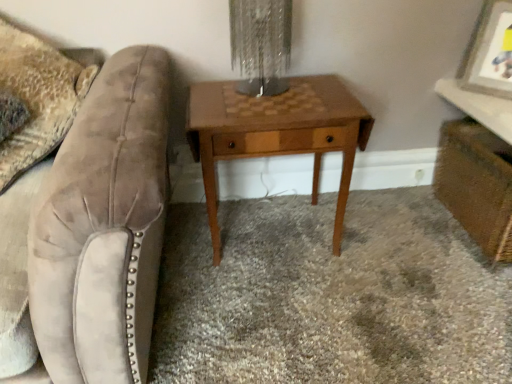
The image size is (512, 384). Identify the location of vacant area that lies to the right of metallic textured lampshade at center. (315, 92).